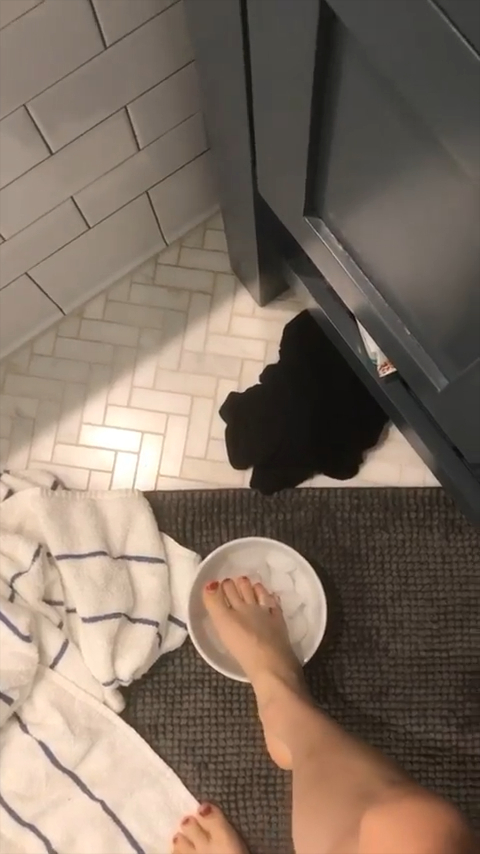
I want to click on large white wall tile, so click(71, 159).